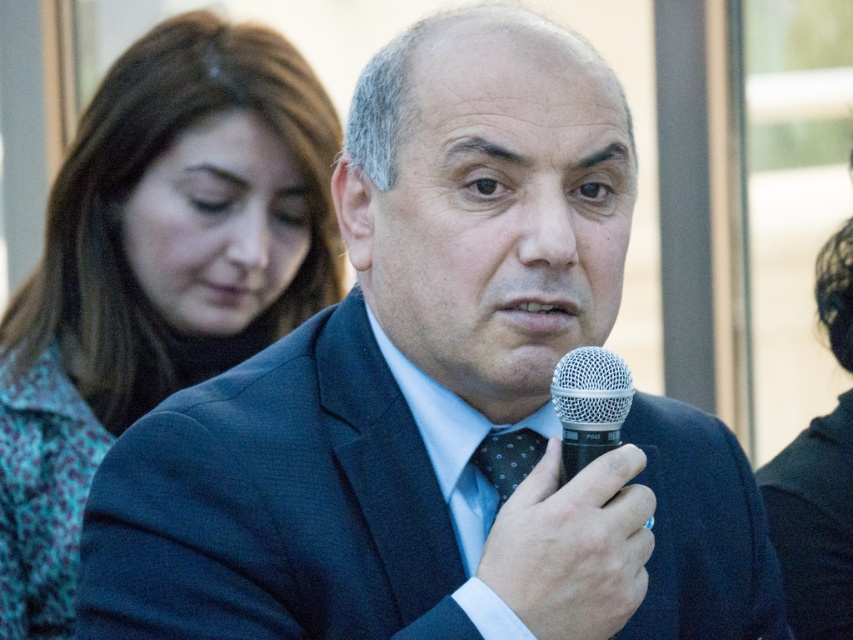
Question: Which is nearer to the dark blue dotted tie at center?

Choices:
 (A) silver metallic microphone at center
 (B) matte floral shirt at left

Answer: (A)

Question: Is silver metallic microphone at center positioned before dark blue dotted tie at center?

Choices:
 (A) no
 (B) yes

Answer: (B)

Question: Can you confirm if matte floral shirt at left is wider than silver metallic microphone at center?

Choices:
 (A) no
 (B) yes

Answer: (B)

Question: Which point appears farthest from the camera in this image?

Choices:
 (A) (24, 296)
 (B) (613, 362)
 (C) (514, 449)

Answer: (A)

Question: Which point is closer to the camera taking this photo?

Choices:
 (A) (512, 461)
 (B) (608, 396)

Answer: (B)

Question: Does matte floral shirt at left have a greater width compared to dark blue dotted tie at center?

Choices:
 (A) yes
 (B) no

Answer: (A)